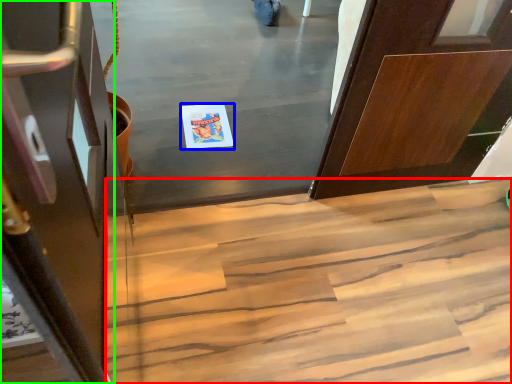
Question: Considering the real-world distances, which object is farthest from stairs (highlighted by a red box)? postcard (highlighted by a blue box) or door (highlighted by a green box)?

Choices:
 (A) postcard
 (B) door

Answer: (B)